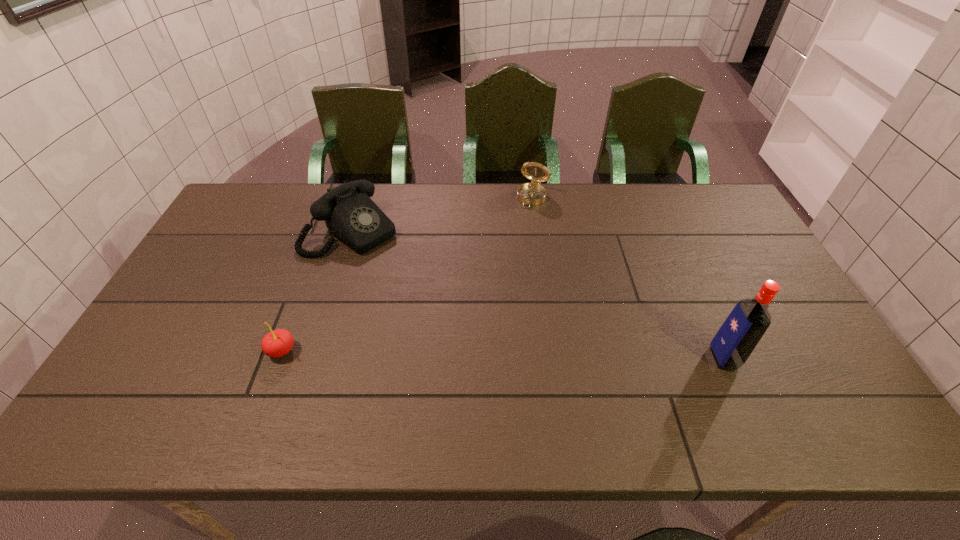
This screenshot has width=960, height=540. Find the location of `free space on the desktop that is between the cherry and the tallest object and is positioned on the dial of the telephone`. free space on the desktop that is between the cherry and the tallest object and is positioned on the dial of the telephone is located at coordinates (504, 354).

Locate an element on the screen. vacant space on the desktop that is between the cherry and the vodka and is positioned with the dial facing the compass is located at coordinates click(x=456, y=354).